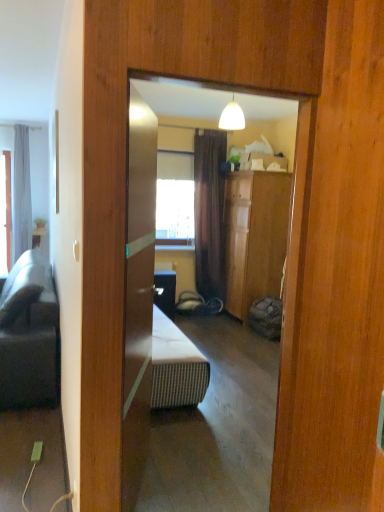
Question: Should I look upward or downward to see matte white table at left?

Choices:
 (A) down
 (B) up

Answer: (B)

Question: Does matte white table at left have a smaller size compared to dark gray fabric studio couch at left?

Choices:
 (A) no
 (B) yes

Answer: (B)

Question: Would you say matte white table at left contains dark gray fabric studio couch at left?

Choices:
 (A) yes
 (B) no

Answer: (B)

Question: Does matte white table at left have a greater width compared to dark gray fabric studio couch at left?

Choices:
 (A) yes
 (B) no

Answer: (B)

Question: Does matte white table at left come behind dark gray fabric studio couch at left?

Choices:
 (A) yes
 (B) no

Answer: (A)

Question: Is matte white table at left beside dark gray fabric studio couch at left?

Choices:
 (A) yes
 (B) no

Answer: (B)

Question: Is dark gray fabric studio couch at left at the back of matte white table at left?

Choices:
 (A) no
 (B) yes

Answer: (A)

Question: Considering the relative positions of gray fabric curtain at left and matte white table at left in the image provided, is gray fabric curtain at left behind matte white table at left?

Choices:
 (A) no
 (B) yes

Answer: (A)

Question: Can you confirm if gray fabric curtain at left is shorter than matte white table at left?

Choices:
 (A) yes
 (B) no

Answer: (B)

Question: From the image's perspective, is gray fabric curtain at left located beneath matte white table at left?

Choices:
 (A) yes
 (B) no

Answer: (B)

Question: Could you tell me if gray fabric curtain at left is facing matte white table at left?

Choices:
 (A) yes
 (B) no

Answer: (B)

Question: Does gray fabric curtain at left appear on the left side of matte white table at left?

Choices:
 (A) no
 (B) yes

Answer: (B)

Question: Can you confirm if gray fabric curtain at left is smaller than matte white table at left?

Choices:
 (A) yes
 (B) no

Answer: (B)

Question: From the image's perspective, is matte white table at left below gray fabric curtain at left?

Choices:
 (A) no
 (B) yes

Answer: (B)